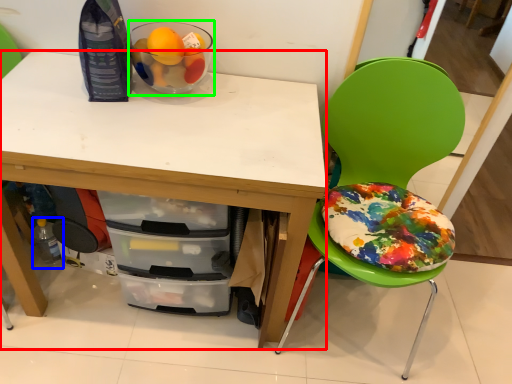
Question: Which object is positioned farthest from desk (highlighted by a red box)? Select from bottle (highlighted by a blue box) and glass bowl (highlighted by a green box).

Choices:
 (A) bottle
 (B) glass bowl

Answer: (A)